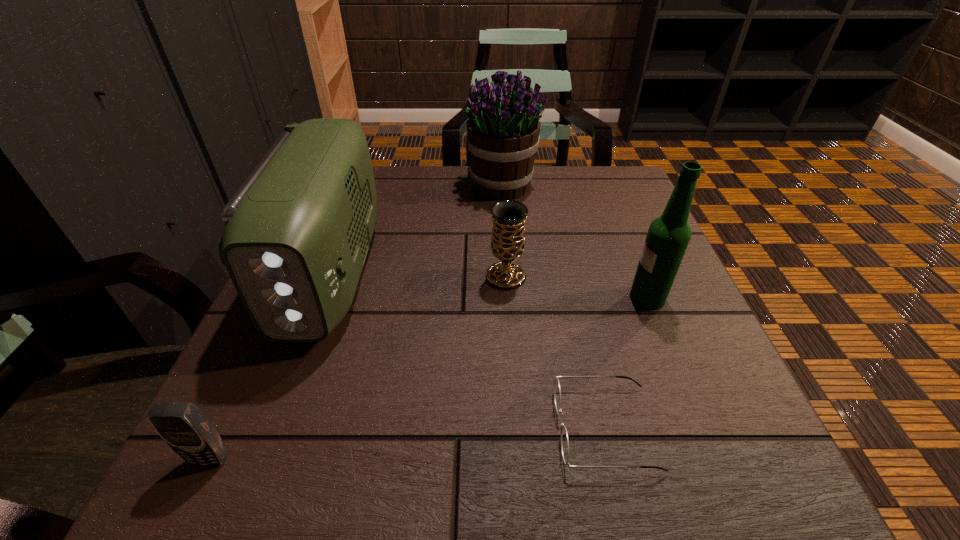
Find the location of a particular element. Image resolution: width=960 pixels, height=540 pixels. cellular telephone that is at the left edge is located at coordinates (181, 425).

Identify the location of beer bottle positioned at the right edge. (668, 236).

Locate an element on the screen. The image size is (960, 540). spectacles present at the right edge is located at coordinates (557, 391).

I want to click on object present at the far left corner, so click(297, 232).

You are a GUI agent. You are given a task and a screenshot of the screen. Output one action in this format:
    pyautogui.click(x=<x>, y=<y>)
    Task: Click on the object that is at the near left corner
    
    Given the screenshot: What is the action you would take?
    pyautogui.click(x=181, y=425)

Find the location of a particular element. object that is at the near right corner is located at coordinates (557, 391).

In the image, there is a desktop. Where is `vacant space at the far edge`? vacant space at the far edge is located at coordinates (576, 212).

Find the location of a particular element. vacant area at the near edge of the desktop is located at coordinates (333, 447).

In the image, there is a desktop. What are the coordinates of `vacant space at the left edge` in the screenshot? It's located at (255, 410).

The height and width of the screenshot is (540, 960). What are the coordinates of `vacant space at the right edge of the desktop` in the screenshot? It's located at (653, 390).